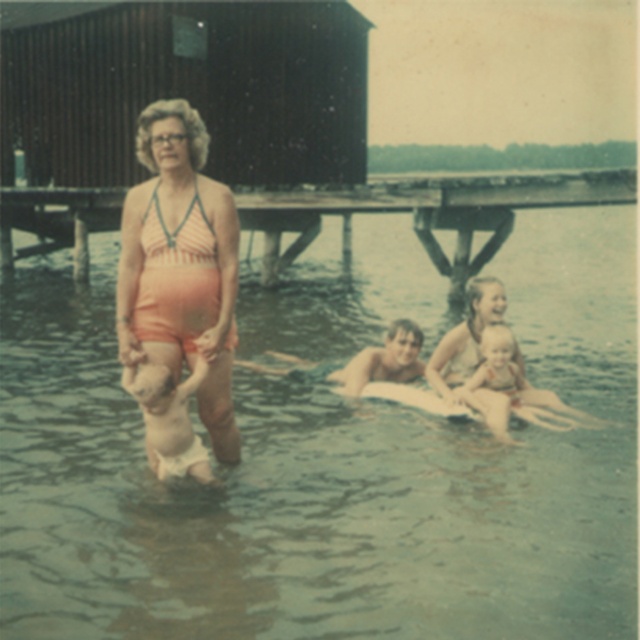
Question: Which is farther from the clear water at center?

Choices:
 (A) wooden at upper center
 (B) light pink fabric diaper at lower left
 (C) orange fabric swimsuit at center

Answer: (B)

Question: Is light pink fabric diaper at lower left to the left of blue-green fabric towel at center from the viewer's perspective?

Choices:
 (A) yes
 (B) no

Answer: (A)

Question: Among these objects, which one is nearest to the camera?

Choices:
 (A) wooden at upper center
 (B) clear water at center

Answer: (B)

Question: Observing the image, what is the correct spatial positioning of wooden at upper center in reference to light pink fabric diaper at lower left?

Choices:
 (A) above
 (B) below

Answer: (A)

Question: Is wooden at upper center to the right of white cloth diaper at lower center from the viewer's perspective?

Choices:
 (A) no
 (B) yes

Answer: (B)

Question: Which point is closer to the camera taking this photo?

Choices:
 (A) (198, 456)
 (B) (440, 440)
 (C) (355, 371)

Answer: (A)